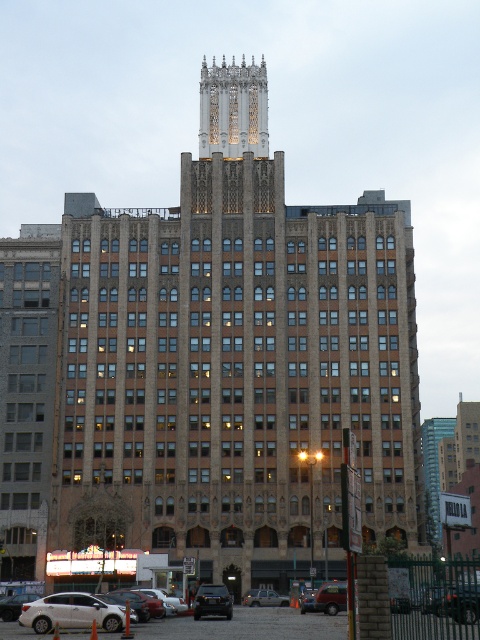
Question: Is brown stone building at center above shiny black suv at center?

Choices:
 (A) no
 (B) yes

Answer: (B)

Question: In this image, where is brown stone building at center located relative to matte black suv at center?

Choices:
 (A) above
 (B) below

Answer: (A)

Question: Which object is farther from the camera taking this photo?

Choices:
 (A) brown stone building at center
 (B) matte black suv at center
 (C) shiny black suv at center

Answer: (B)

Question: Is brown stone building at center positioned behind shiny black suv at center?

Choices:
 (A) yes
 (B) no

Answer: (B)

Question: Which point is farther to the camera?

Choices:
 (A) matte black suv at center
 (B) brown stone building at center

Answer: (A)

Question: Estimate the real-world distances between objects in this image. Which object is closer to the brown stone building at center?

Choices:
 (A) shiny black suv at center
 (B) matte black suv at center

Answer: (B)